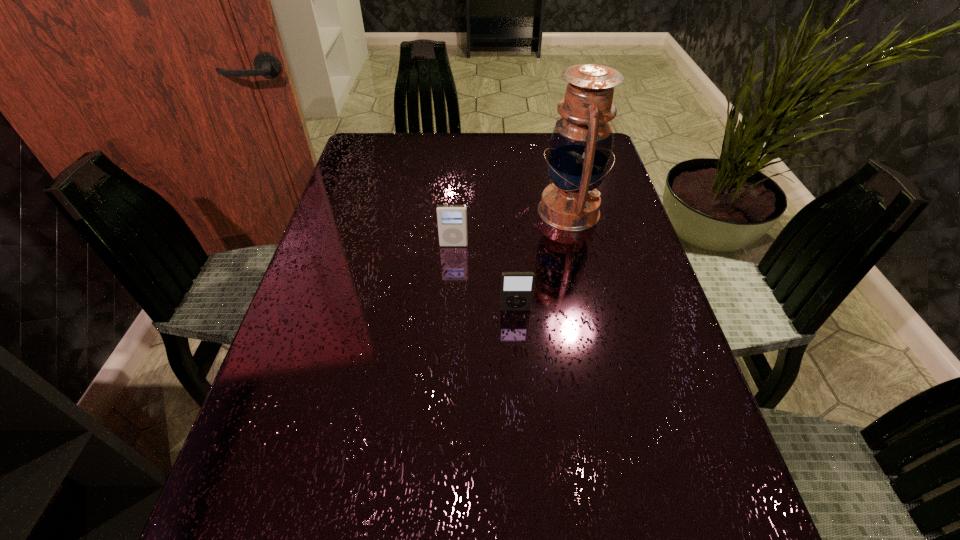
Locate an element on the screen. This screenshot has height=540, width=960. vacant area at the far edge of the desktop is located at coordinates (462, 146).

In order to click on free space at the left edge of the desktop in this screenshot , I will do `click(365, 239)`.

At what (x,y) coordinates should I click in order to perform the action: click on vacant region at the right edge of the desktop. Please return your answer as a coordinate pair (x, y). Image resolution: width=960 pixels, height=540 pixels. Looking at the image, I should click on (624, 196).

Find the location of a particular element. This screenshot has width=960, height=540. free space at the far left corner is located at coordinates (383, 158).

Where is `vacant space in between the farthest object and the second nearest object`? The image size is (960, 540). vacant space in between the farthest object and the second nearest object is located at coordinates (512, 228).

What are the coordinates of `vacant space that is in between the nearer iPod and the leftmost object` in the screenshot? It's located at (485, 277).

Identify which object is the closest to the left iPod. Please provide its 2D coordinates. Your answer should be formatted as a tuple, i.e. [(x, y)], where the tuple contains the x and y coordinates of a point satisfying the conditions above.

[(580, 149)]

At what (x,y) coordinates should I click in order to perform the action: click on object that can be found as the second closest to the farther iPod. Please return your answer as a coordinate pair (x, y). The width and height of the screenshot is (960, 540). Looking at the image, I should click on (517, 288).